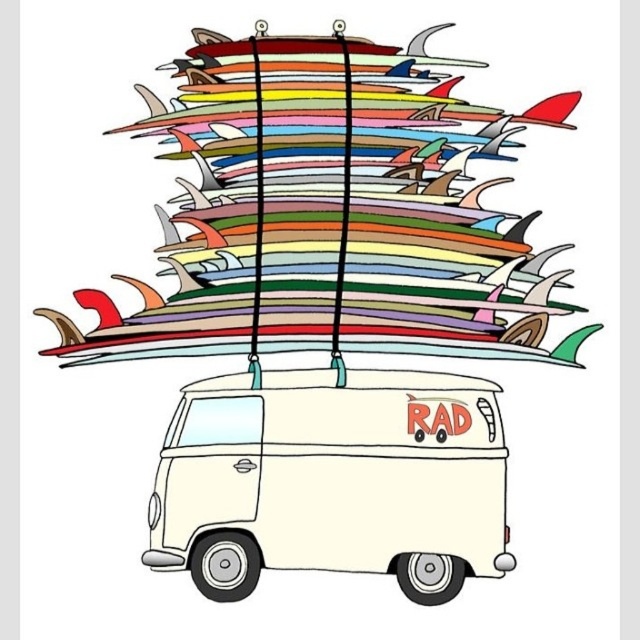
Question: Which object appears farthest from the camera in this image?

Choices:
 (A) white matte van at center
 (B) multicolored surfboards at upper center

Answer: (B)

Question: Where is multicolored surfboards at upper center located in relation to white matte van at center in the image?

Choices:
 (A) above
 (B) below

Answer: (A)

Question: Which point appears farthest from the camera in this image?

Choices:
 (A) (368, 140)
 (B) (369, 420)

Answer: (A)

Question: Which point is farther to the camera?

Choices:
 (A) white matte van at center
 (B) multicolored surfboards at upper center

Answer: (B)

Question: Is multicolored surfboards at upper center to the right of white matte van at center from the viewer's perspective?

Choices:
 (A) yes
 (B) no

Answer: (B)

Question: Can you confirm if multicolored surfboards at upper center is positioned to the right of white matte van at center?

Choices:
 (A) no
 (B) yes

Answer: (A)